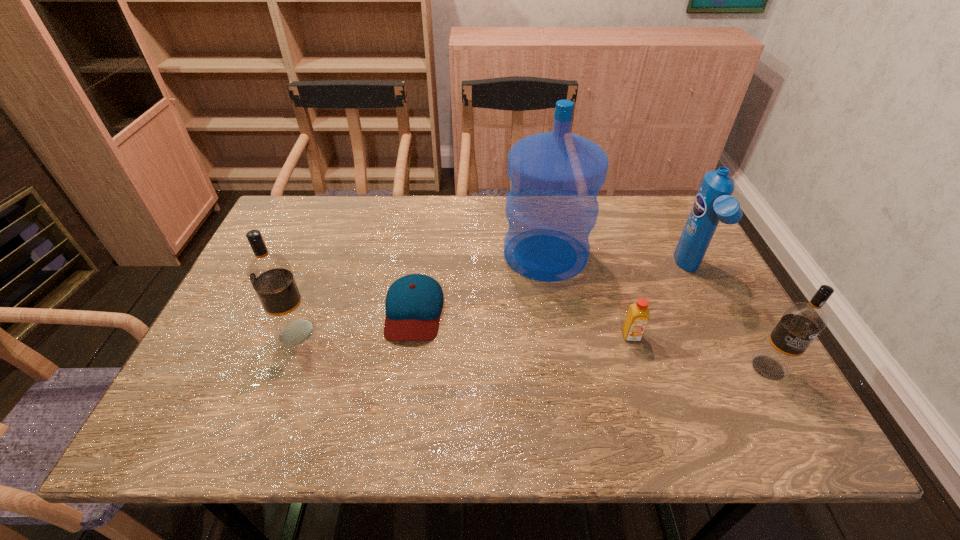
What are the coordinates of `baseball cap` in the screenshot? It's located at (414, 302).

Where is `free space located on the label of the farther vodka`? free space located on the label of the farther vodka is located at coordinates (255, 333).

You are a GUI agent. You are given a task and a screenshot of the screen. Output one action in this format:
    pyautogui.click(x=<x>, y=<y>)
    Task: Click on the free space located 0.150m on the label of the farther vodka
    
    Given the screenshot: What is the action you would take?
    pyautogui.click(x=213, y=333)

Identify the location of free spot located 0.190m on the right of the water jug. (655, 254).

Locate an element on the screen. blank space located 0.130m on the front and back of the fifth tallest object is located at coordinates (649, 392).

You are a GUI agent. You are given a task and a screenshot of the screen. Output one action in this format:
    pyautogui.click(x=<x>, y=<y>)
    Task: Click on the vacant space situated 0.050m on the left of the shampoo
    This screenshot has width=960, height=540.
    Given the screenshot: What is the action you would take?
    pyautogui.click(x=660, y=271)

Where is `vacant space located 0.100m with the bill of the fifth object from right to left facing forward`? This screenshot has height=540, width=960. vacant space located 0.100m with the bill of the fifth object from right to left facing forward is located at coordinates (404, 382).

In order to click on object that is at the far edge in this screenshot , I will do `click(551, 208)`.

You are a GUI agent. You are given a task and a screenshot of the screen. Output one action in this format:
    pyautogui.click(x=<x>, y=<y>)
    Task: Click on the object located in the near edge section of the desktop
    The height and width of the screenshot is (540, 960).
    Given the screenshot: What is the action you would take?
    pyautogui.click(x=802, y=322)

This screenshot has height=540, width=960. Identify the location of object that is at the left edge. (270, 274).